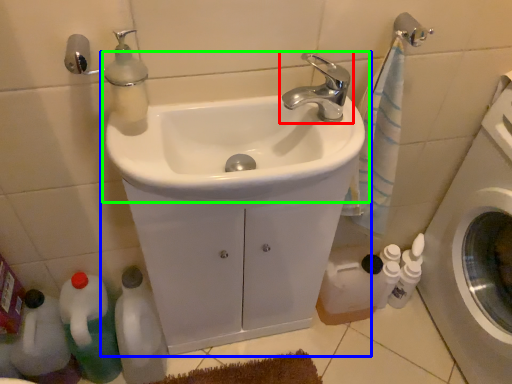
Question: Which is farther away from tap (highlighted by a red box)? sink (highlighted by a blue box) or sink (highlighted by a green box)?

Choices:
 (A) sink
 (B) sink

Answer: (A)